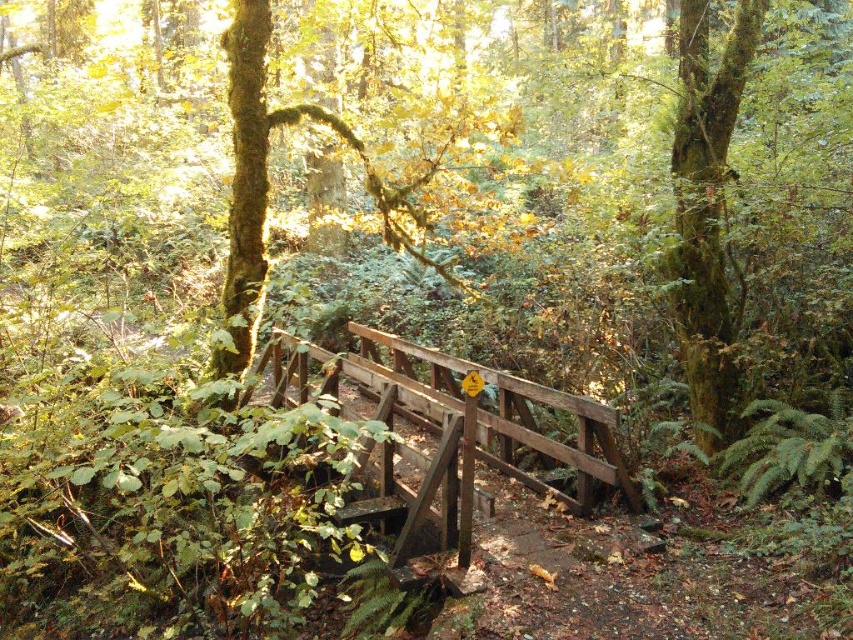
Does point (299, 401) come farther from viewer compared to point (711, 316)?

Yes, it is behind point (711, 316).

Does wooden bridge at center have a larger size compared to green mossy tree at upper right?

Actually, wooden bridge at center might be smaller than green mossy tree at upper right.

Where is `wooden bridge at center`? The image size is (853, 640). wooden bridge at center is located at coordinates (450, 435).

You are a GUI agent. You are given a task and a screenshot of the screen. Output one action in this format:
    pyautogui.click(x=<x>, y=<y>)
    Task: Click on the wooden bridge at center
    The image size is (853, 640).
    Given the screenshot: What is the action you would take?
    pyautogui.click(x=450, y=435)

Does wooden bridge at center have a greater width compared to green mossy tree at upper left?

Yes, wooden bridge at center is wider than green mossy tree at upper left.

The height and width of the screenshot is (640, 853). Describe the element at coordinates (450, 435) in the screenshot. I see `wooden bridge at center` at that location.

Image resolution: width=853 pixels, height=640 pixels. I want to click on wooden bridge at center, so click(x=450, y=435).

This screenshot has width=853, height=640. I want to click on wooden bridge at center, so click(x=450, y=435).

Between point (718, 65) and point (233, 77), which one is positioned in front?

Positioned in front is point (233, 77).

Who is positioned more to the right, green mossy tree at upper right or green mossy tree at upper left?

Positioned to the right is green mossy tree at upper right.

What do you see at coordinates (706, 209) in the screenshot? The height and width of the screenshot is (640, 853). I see `green mossy tree at upper right` at bounding box center [706, 209].

Locate an element on the screen. Image resolution: width=853 pixels, height=640 pixels. green mossy tree at upper right is located at coordinates (706, 209).